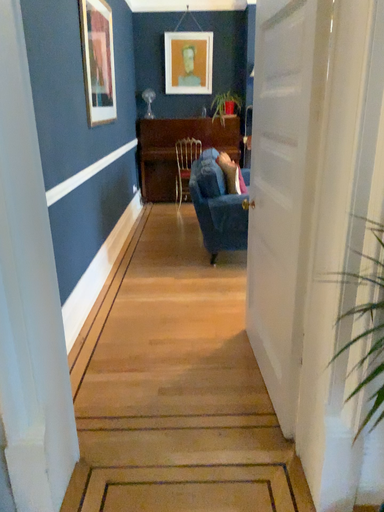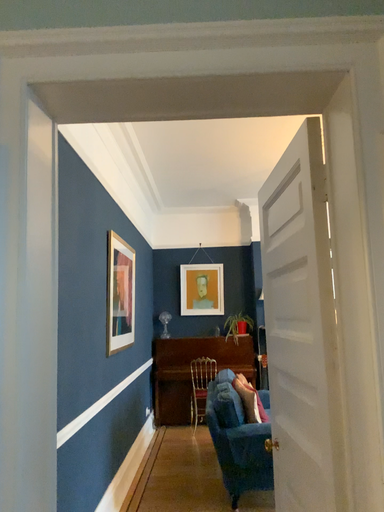
Question: Which way did the camera rotate in the video?

Choices:
 (A) rotated upward
 (B) rotated downward

Answer: (A)